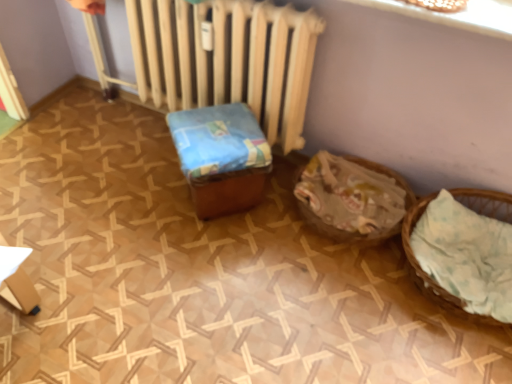
Locate an element on the screen. vacant space that is in between blue fabric-covered box at center and brown woven basket at lower right, arranged as the first basket when viewed from the left is located at coordinates (279, 232).